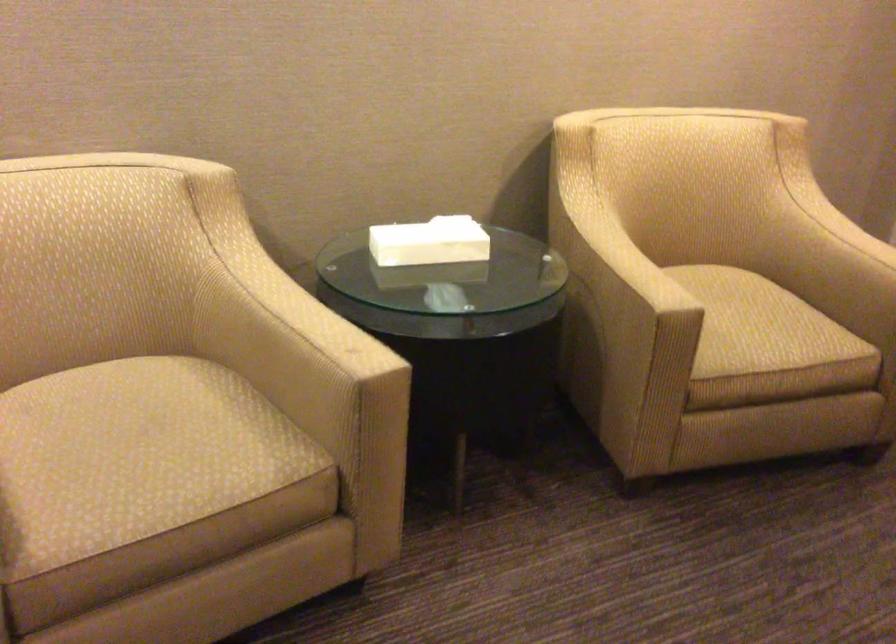
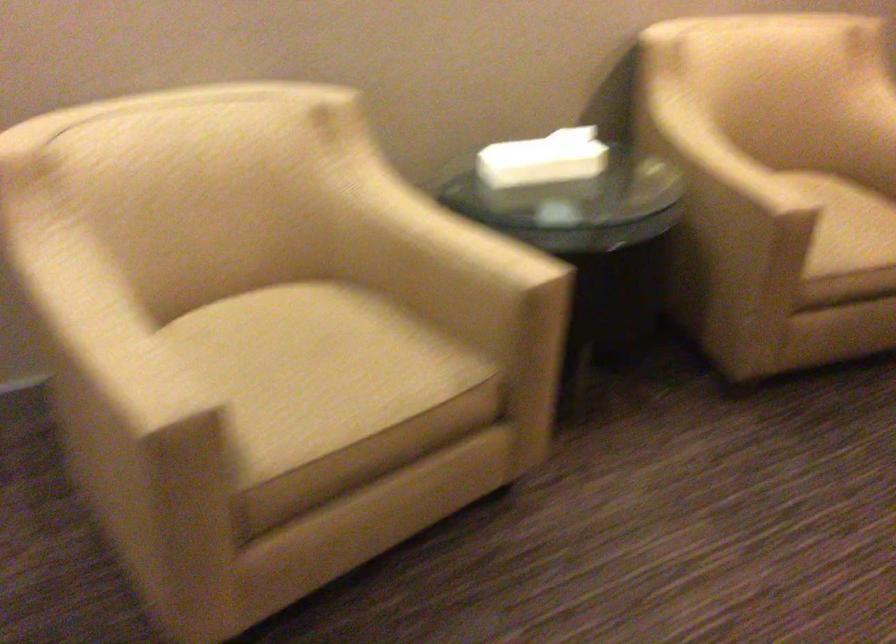
In the second image, find the point that corresponds to point (134, 451) in the first image.

(316, 370)